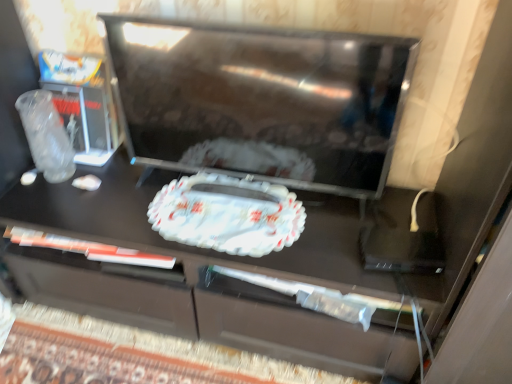
The height and width of the screenshot is (384, 512). What do you see at coordinates (227, 214) in the screenshot? I see `white glossy tray at center` at bounding box center [227, 214].

Find the location of a particular element. This screenshot has height=384, width=512. white glossy tray at center is located at coordinates (227, 214).

Identify the location of black glossy tv at center. The width and height of the screenshot is (512, 384). (261, 101).

The image size is (512, 384). Describe the element at coordinates (261, 101) in the screenshot. I see `black glossy tv at center` at that location.

In order to face black glossy tv at center, should I rotate leftwards or rightwards?

Rotate left and turn 0.605 degrees.

Locate an element on the screen. The image size is (512, 384). white glossy tray at center is located at coordinates (227, 214).

Is white glossy tray at center to the left of black glossy tv at center from the viewer's perspective?

Yes, white glossy tray at center is to the left of black glossy tv at center.

Which object is closer to the camera, white glossy tray at center or black glossy tv at center?

black glossy tv at center is closer to the camera.

Is point (269, 219) behind point (132, 111)?

That is False.

From the image's perspective, which object appears higher, white glossy tray at center or black glossy tv at center?

black glossy tv at center.

From a real-world perspective, which is physically below, white glossy tray at center or black glossy tv at center?

white glossy tray at center.

Considering the sizes of objects white glossy tray at center and black glossy tv at center in the image provided, who is thinner, white glossy tray at center or black glossy tv at center?

black glossy tv at center.

Between white glossy tray at center and black glossy tv at center, which one has more height?

black glossy tv at center.

Is white glossy tray at center smaller than black glossy tv at center?

Yes, white glossy tray at center is smaller than black glossy tv at center.

Is white glossy tray at center outside of black glossy tv at center?

No, most part of white glossy tray at center lies within black glossy tv at center.

Looking at this image, is white glossy tray at center far away from black glossy tv at center?

No, white glossy tray at center is not far from black glossy tv at center.

Could you tell me if white glossy tray at center is facing black glossy tv at center?

No, white glossy tray at center is not turned towards black glossy tv at center.

How many degrees apart are the facing directions of white glossy tray at center and black glossy tv at center?

3.84 degrees separate the facing orientations of white glossy tray at center and black glossy tv at center.

Locate an element on the screen. food on the left of black glossy tv at center is located at coordinates (227, 214).

Is black glossy tv at center at the right side of white glossy tray at center?

Yes.

Considering the positions of objects black glossy tv at center and white glossy tray at center in the image provided, who is in front, black glossy tv at center or white glossy tray at center?

black glossy tv at center.

Which point is more distant from viewer, (332, 171) or (277, 234)?

Point (332, 171)

From the image's perspective, is black glossy tv at center under white glossy tray at center?

Actually, black glossy tv at center appears above white glossy tray at center in the image.

From a real-world perspective, is black glossy tv at center positioned under white glossy tray at center based on gravity?

No.

Considering the sizes of objects black glossy tv at center and white glossy tray at center in the image provided, who is thinner, black glossy tv at center or white glossy tray at center?

black glossy tv at center.

Between black glossy tv at center and white glossy tray at center, which one has less height?

white glossy tray at center.

Does black glossy tv at center have a larger size compared to white glossy tray at center?

Correct, black glossy tv at center is larger in size than white glossy tray at center.

From the picture: Is black glossy tv at center positioned beyond the bounds of white glossy tray at center?

black glossy tv at center is positioned outside white glossy tray at center.

Is black glossy tv at center directly adjacent to white glossy tray at center?

No, black glossy tv at center is not beside white glossy tray at center.

Consider the image. Is black glossy tv at center oriented towards white glossy tray at center?

Yes, black glossy tv at center is facing white glossy tray at center.

How different are the orientations of black glossy tv at center and white glossy tray at center in degrees?

The angular difference between black glossy tv at center and white glossy tray at center is 3.84 degrees.

Measure the distance between black glossy tv at center and white glossy tray at center.

They are 8.01 inches apart.

Image resolution: width=512 pixels, height=384 pixels. What are the coordinates of `appliance above the white glossy tray at center (from a real-world perspective)` in the screenshot? It's located at coord(261,101).

Identify the location of appliance that appears in front of the white glossy tray at center. Image resolution: width=512 pixels, height=384 pixels. (261, 101).

Find the location of a particular element. food behind the black glossy tv at center is located at coordinates (227, 214).